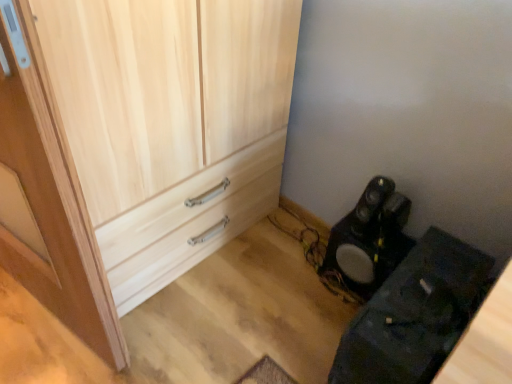
This screenshot has height=384, width=512. In order to click on vacant region to the left of black matte speaker at lower right in this screenshot , I will do `click(280, 337)`.